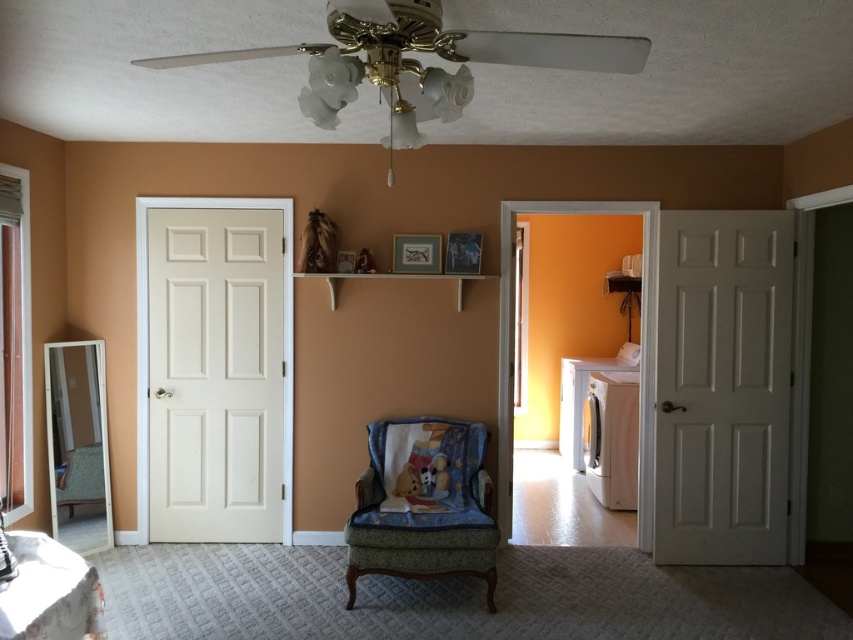
Is white plastic fan at upper center shorter than velvet green armchair at center?

Indeed, white plastic fan at upper center has a lesser height compared to velvet green armchair at center.

In the scene shown: Can you confirm if white plastic fan at upper center is positioned to the right of velvet green armchair at center?

Incorrect, white plastic fan at upper center is not on the right side of velvet green armchair at center.

This screenshot has height=640, width=853. In order to click on white plastic fan at upper center in this screenshot , I will do `click(416, 60)`.